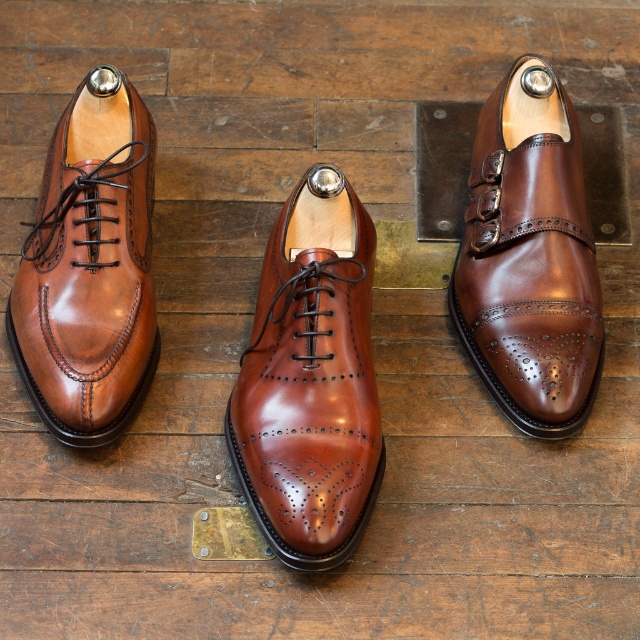
You are organizing a display of men shoes. You have a shiny brown leather shoe at center and a shiny brown leather shoe at upper center. According to the image, which one is positioned to the left?

The shiny brown leather shoe at center is to the left of the shiny brown leather shoe at upper center.

You are a delivery person who needs to place a box that is 26 inches long between the shiny brown leather shoe at upper center and the matte brown leather shoe at left. Can the box fit in the space between them?

The distance between the shiny brown leather shoe at upper center and the matte brown leather shoe at left is 26.66 inches, which is longer than the box length of 26 inches. Therefore, the box can fit between them.